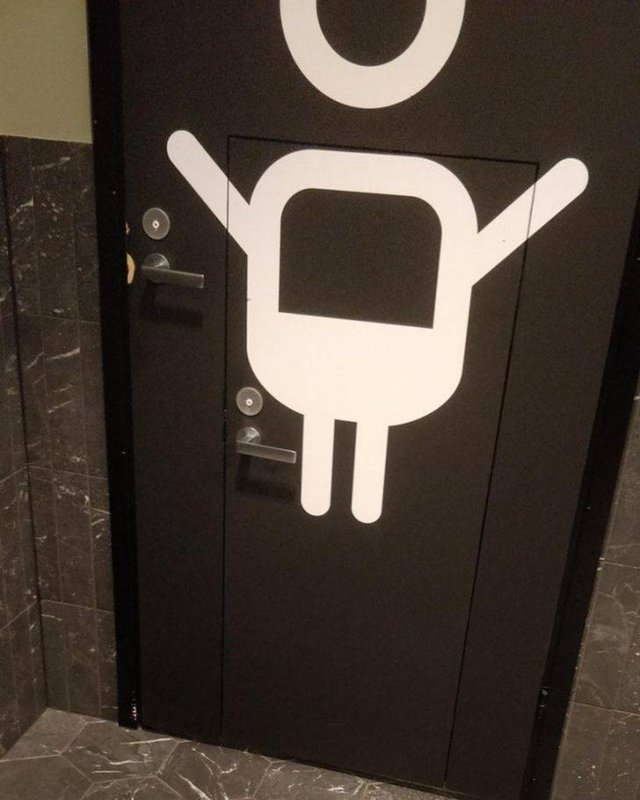
Locate an element on the screen. The height and width of the screenshot is (800, 640). door handle is located at coordinates (157, 278).